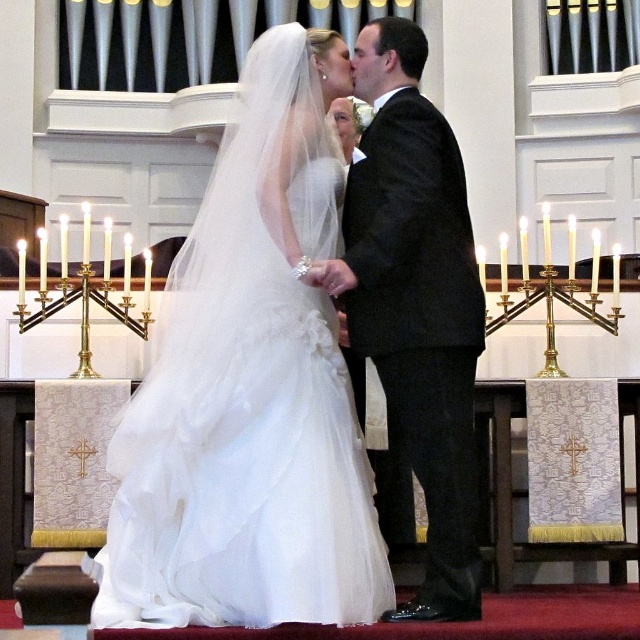
Question: From the image, what is the correct spatial relationship of white tulle dress at center in relation to black satin suit at center?

Choices:
 (A) above
 (B) below

Answer: (A)

Question: Is white tulle dress at center to the right of black satin suit at center from the viewer's perspective?

Choices:
 (A) no
 (B) yes

Answer: (A)

Question: Which of the following is the closest to the observer?

Choices:
 (A) white tulle dress at center
 (B) black satin suit at center

Answer: (A)

Question: Which object appears closest to the camera in this image?

Choices:
 (A) black satin suit at center
 (B) white tulle dress at center

Answer: (B)

Question: Is white tulle dress at center positioned in front of black satin suit at center?

Choices:
 (A) yes
 (B) no

Answer: (A)